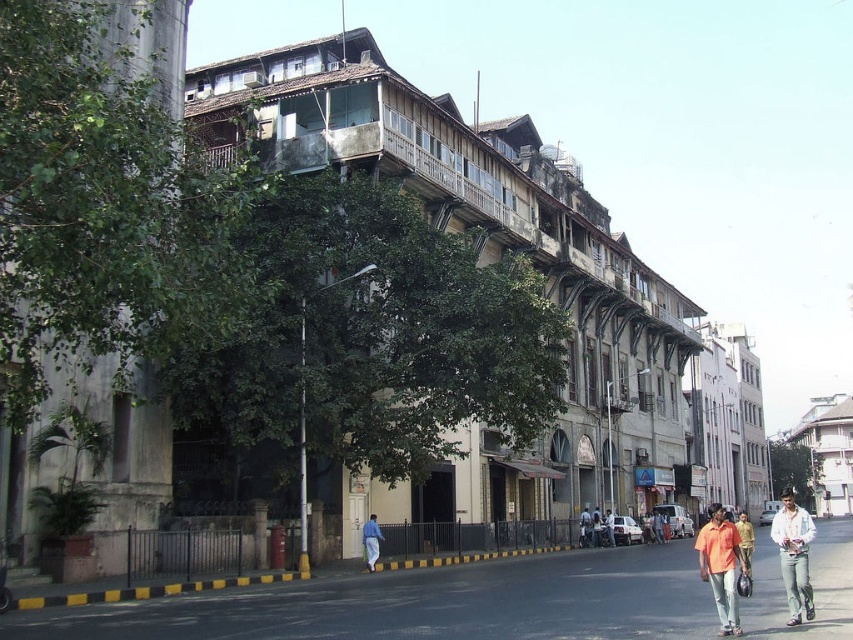
Question: Is black asphalt pavement at lower center to the right of orange cotton shirt at center from the viewer's perspective?

Choices:
 (A) no
 (B) yes

Answer: (A)

Question: Can you confirm if white cotton shirt at lower right is positioned above blue jeans at lower center?

Choices:
 (A) no
 (B) yes

Answer: (A)

Question: Can you confirm if black asphalt pavement at lower center is smaller than blue jeans at lower center?

Choices:
 (A) yes
 (B) no

Answer: (B)

Question: Which object is the farthest from the light blue jeans at center?

Choices:
 (A) yellow cotton shirt at center
 (B) orange cotton shirt at lower right
 (C) white cotton shirt at lower right
 (D) black asphalt pavement at lower center

Answer: (A)

Question: Which point is farther to the camera?

Choices:
 (A) black asphalt pavement at lower center
 (B) white cotton shirt at lower right
 (C) light blue jeans at center
 (D) orange cotton shirt at center

Answer: (D)

Question: Which point appears farthest from the camera in this image?

Choices:
 (A) (608, 524)
 (B) (381, 536)

Answer: (A)